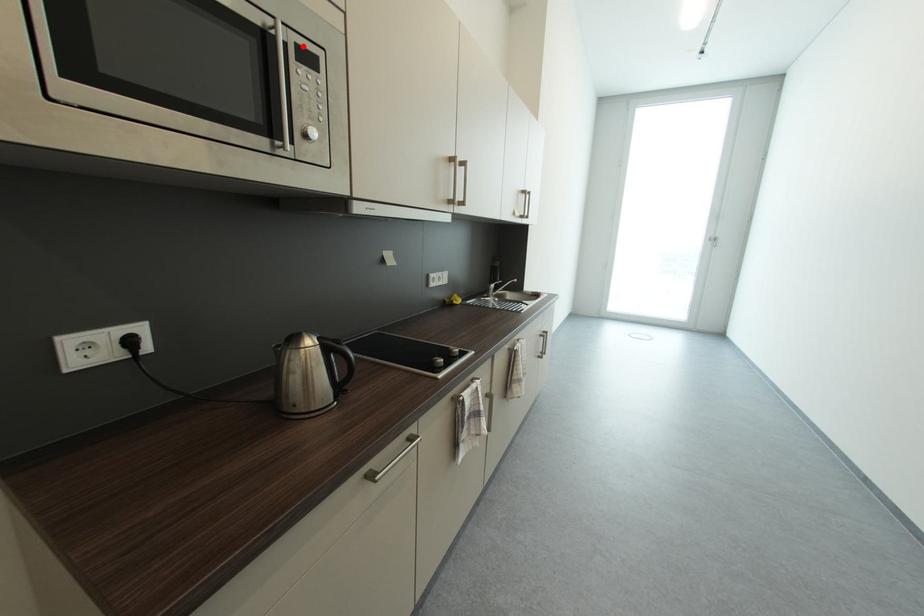
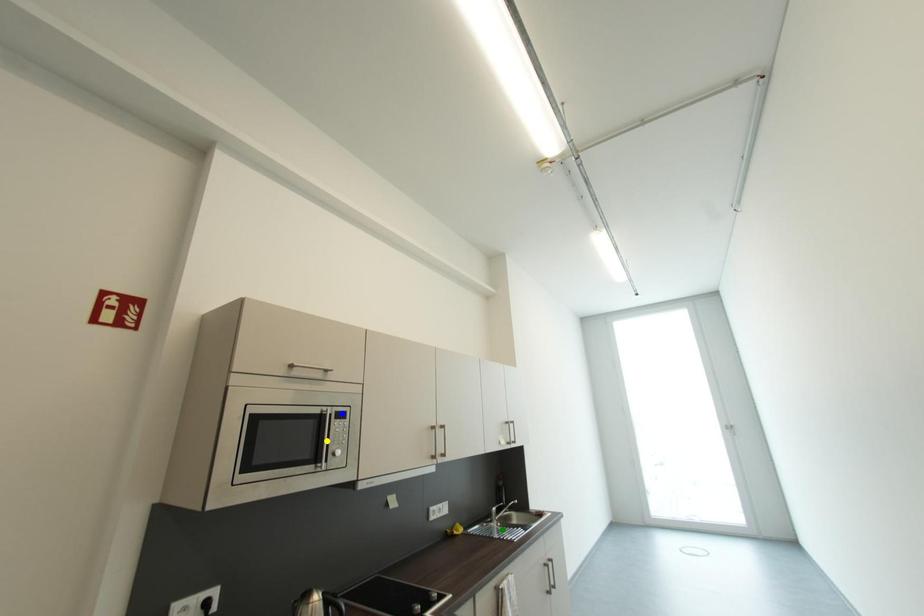
Question: I am providing you with two images of the same scene from different viewpoints. A red point is marked on the first image. You are given multiple points on the second image. Which point in image 2 represents the same 3d spot as the red point in image 1?

Choices:
 (A) blue point
 (B) green point
 (C) yellow point

Answer: (A)